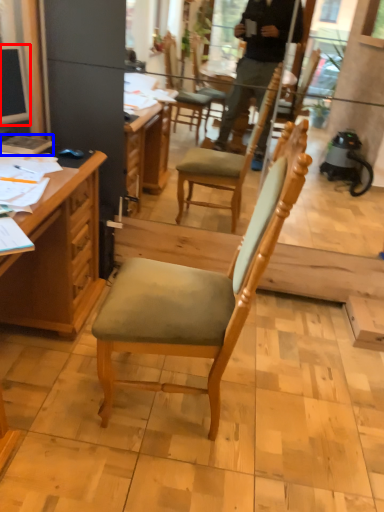
Question: Which object is closer to the camera taking this photo, television (highlighted by a red box) or book (highlighted by a blue box)?

Choices:
 (A) television
 (B) book

Answer: (A)